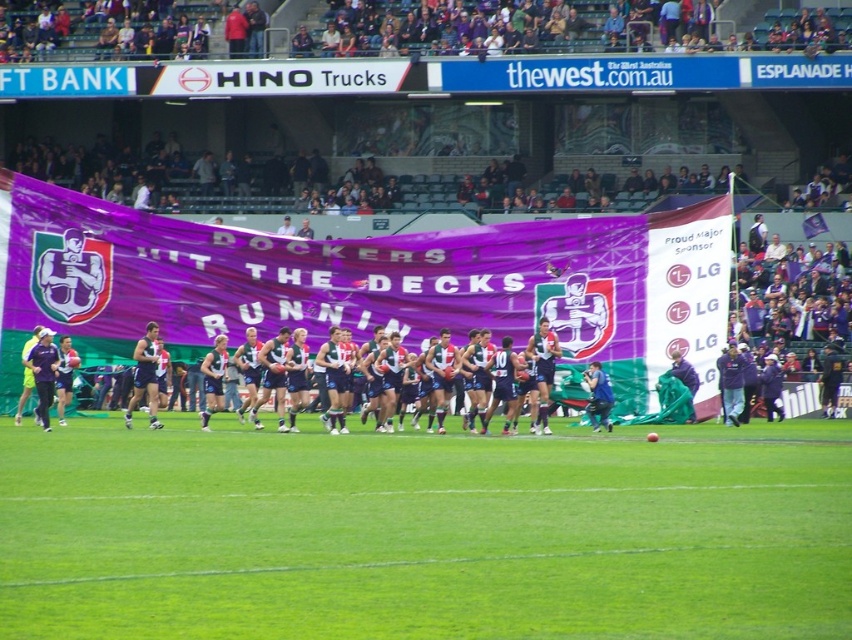
You are a drone operator trying to capture the best aerial shot of the football match. The drone must hover exactly above the green grass at center. According to the coordinates provided, what are the exact coordinates where the drone should position itself?

The drone should position itself at coordinates point [426,532] as the green grass at center is located there.

You are standing at the point marked by the coordinates point (426, 532). What is the color of the ground beneath your feet?

The green grass at center is represented by point (426, 532), so the ground beneath your feet is green grass at center.

Based on the photo, you are standing at the edge of the field and want to kick a ball to the green grass at center. If your maximum kicking distance is 10 meters, will you be able to reach it?

The green grass at center is 12.42 meters away from the viewer. Since your maximum kicking distance is 10 meters, you cannot reach it.